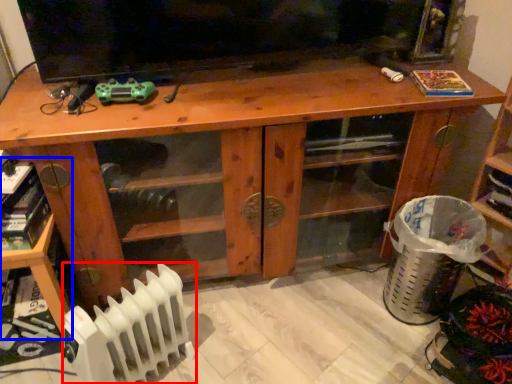
Question: Which point is closer to the camera, radiator (highlighted by a red box) or shelf (highlighted by a blue box)?

Choices:
 (A) radiator
 (B) shelf

Answer: (A)